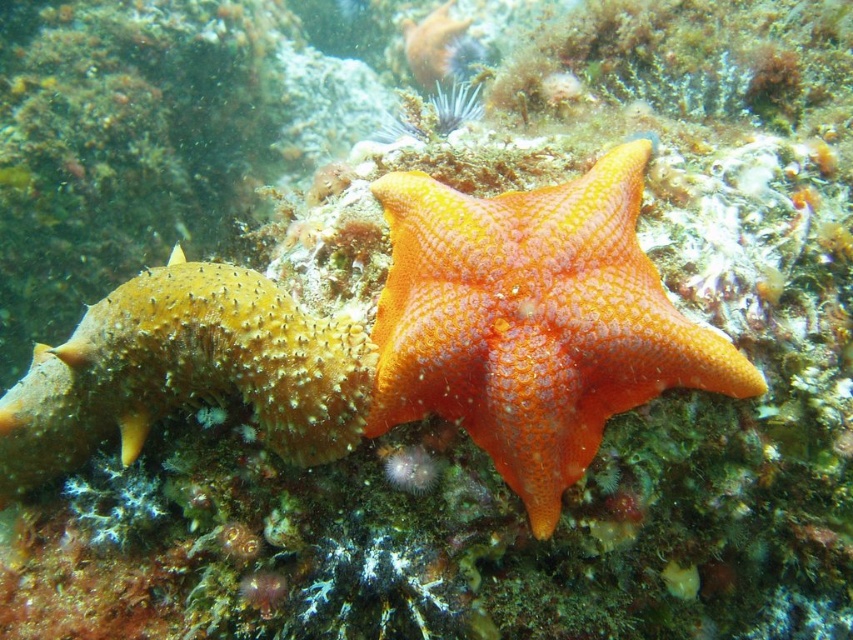
Question: Can you confirm if orange rough starfish at center is positioned above spongy orange starfish at center?

Choices:
 (A) yes
 (B) no

Answer: (A)

Question: Among these points, which one is farthest from the camera?

Choices:
 (A) (572, 337)
 (B) (277, 358)

Answer: (B)

Question: Which point appears closest to the camera in this image?

Choices:
 (A) (590, 211)
 (B) (300, 353)

Answer: (B)

Question: Observing the image, what is the correct spatial positioning of orange rough starfish at center in reference to spongy orange starfish at center?

Choices:
 (A) left
 (B) right

Answer: (B)

Question: Observing the image, what is the correct spatial positioning of orange rough starfish at center in reference to spongy orange starfish at center?

Choices:
 (A) below
 (B) above

Answer: (B)

Question: Which of the following is the farthest from the observer?

Choices:
 (A) orange rough starfish at center
 (B) spongy orange starfish at center

Answer: (B)